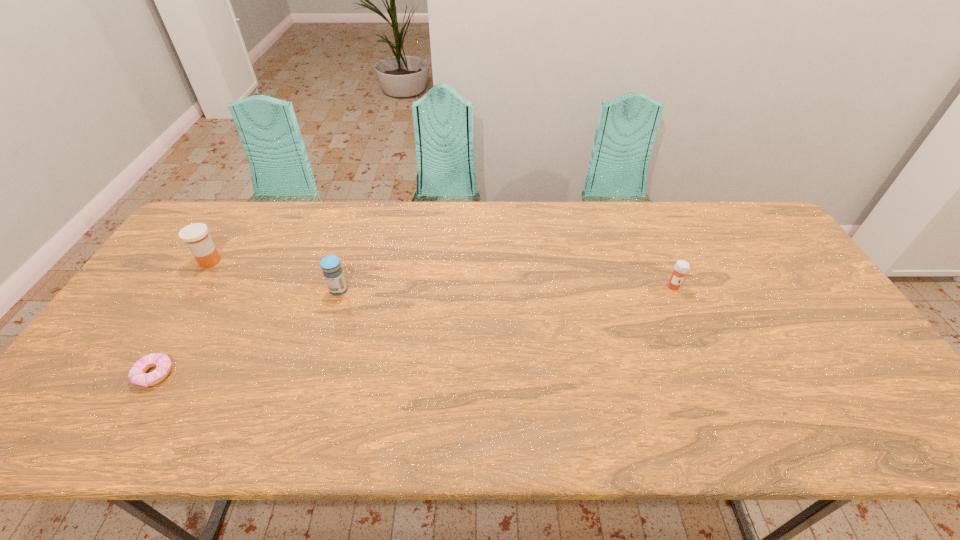
Locate an element on the screen. vacant space located on the back of the doughnut is located at coordinates (206, 288).

The width and height of the screenshot is (960, 540). In order to click on medicine present at the left edge in this screenshot , I will do `click(196, 237)`.

This screenshot has width=960, height=540. I want to click on doughnut present at the left edge, so click(137, 375).

What are the coordinates of `free location at the far edge of the desktop` in the screenshot? It's located at (722, 240).

I want to click on free space at the near edge of the desktop, so click(x=663, y=416).

At what (x,y) coordinates should I click in order to perform the action: click on free spot at the left edge of the desktop. Please return your answer as a coordinate pair (x, y). Looking at the image, I should click on (100, 354).

Where is `vacant region between the doughnut and the third object from left to right`? vacant region between the doughnut and the third object from left to right is located at coordinates (247, 332).

Identify the location of free space between the second medicine from left to right and the farthest medicine. (275, 275).

Find the location of a particular element. Image resolution: width=960 pixels, height=540 pixels. vacant space that is in between the nearest object and the second medicine from left to right is located at coordinates (247, 332).

Locate an element on the screen. The height and width of the screenshot is (540, 960). vacant area that lies between the doughnut and the third object from left to right is located at coordinates (247, 332).